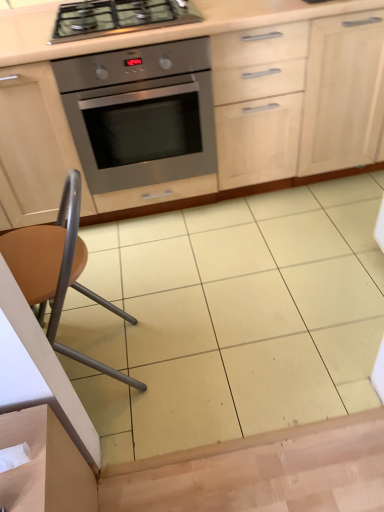
Question: Is brown matte chair at lower left to the left or to the right of stainless steel oven at center in the image?

Choices:
 (A) left
 (B) right

Answer: (A)

Question: Which is correct: brown matte chair at lower left is inside stainless steel oven at center, or outside of it?

Choices:
 (A) outside
 (B) inside

Answer: (A)

Question: Based on their relative distances, which object is farther from the matte wood cabinetry at center?

Choices:
 (A) brown matte chair at lower left
 (B) stainless steel gas stove at upper center
 (C) stainless steel oven at center

Answer: (A)

Question: Estimate the real-world distances between objects in this image. Which object is closer to the stainless steel gas stove at upper center?

Choices:
 (A) stainless steel oven at center
 (B) matte wood cabinetry at center
 (C) brown matte chair at lower left

Answer: (A)